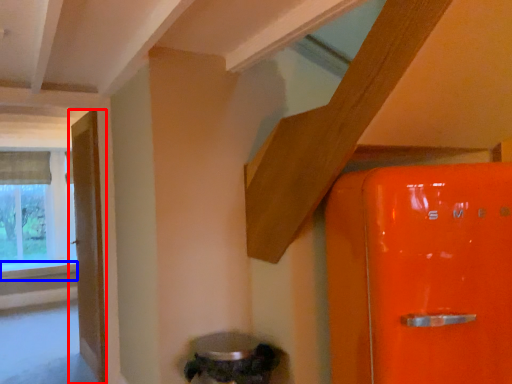
Question: Which point is further to the camera, door (highlighted by a red box) or window sill (highlighted by a blue box)?

Choices:
 (A) door
 (B) window sill

Answer: (B)